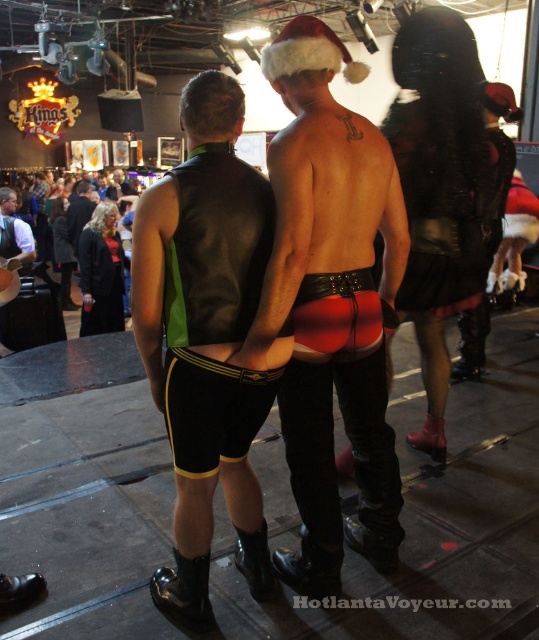
You are a fashion designer observing the image and want to create a new outfit that incorporates elements from both the shiny leather shorts at center and the black leather vest at center. Considering their positions in the image, which item is positioned higher up on the body and should be the focal point of the design?

The shiny leather shorts at center has a greater height compared to the black leather vest at center, so it is positioned higher up on the body and should be the focal point of the design.

You are a photographer at the event and want to capture a closeup of the black leather vest at center without the shiny leather shorts at center covering it. Is this possible given their current positions?

The shiny leather shorts at center is positioned over black leather vest at center, so it is not possible to capture a closeup of the black leather vest at center without the shiny leather shorts at center covering it.

You are a photographer trying to capture a candid shot of the two people in the scene. You notice the shiny leather shorts at center and the black leather vest at center. Given that your camera has a minimum focus distance of 10 inches, will you be able to focus on either of these items without moving closer?

The distance between the shiny leather shorts at center and the black leather vest at center is 9.29 inches, which is less than the camera minimum focus distance of 10 inches. Therefore, you cannot focus on either item without moving closer.